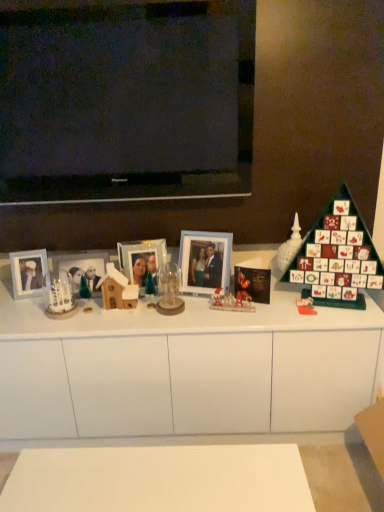
What are the coordinates of `vacant space behind translucent plastic figurines at center, placed as the 3th toy when sorted from left to right` in the screenshot? It's located at (221, 300).